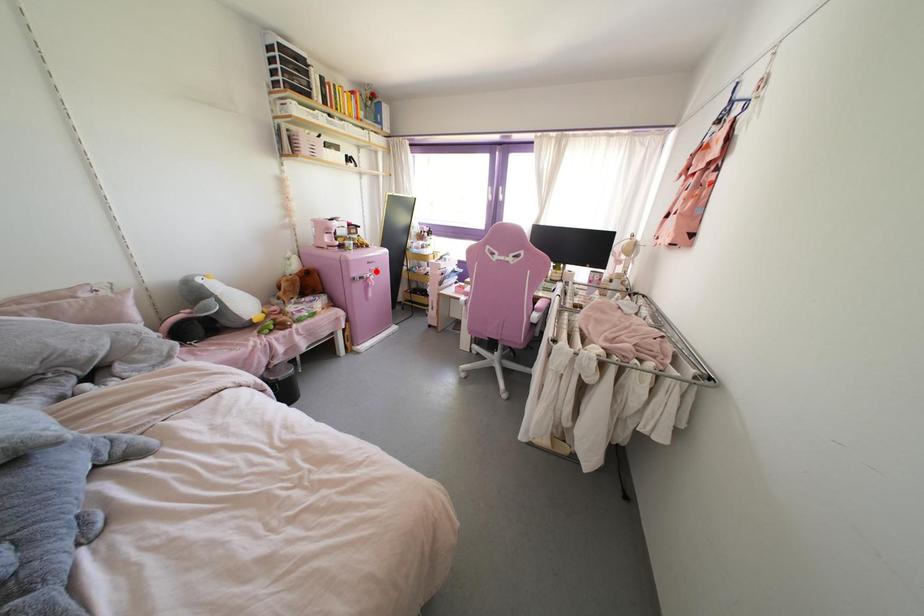
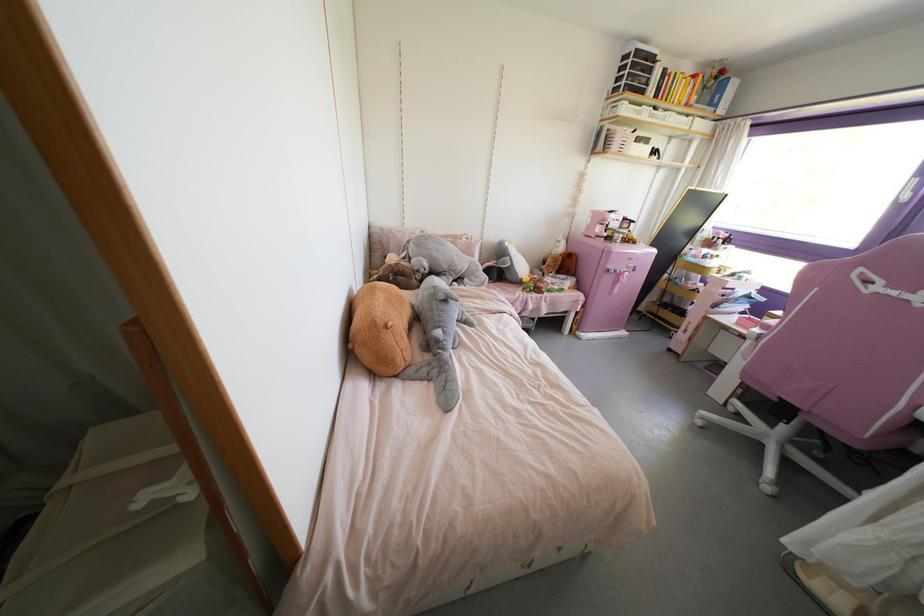
Question: A red point is marked in image1. In image2, is the corresponding 3D point closer to the camera or farther? Reply with the corresponding letter.

Choices:
 (A) The corresponding 3D point is closer.
 (B) The corresponding 3D point is farther.

Answer: (B)